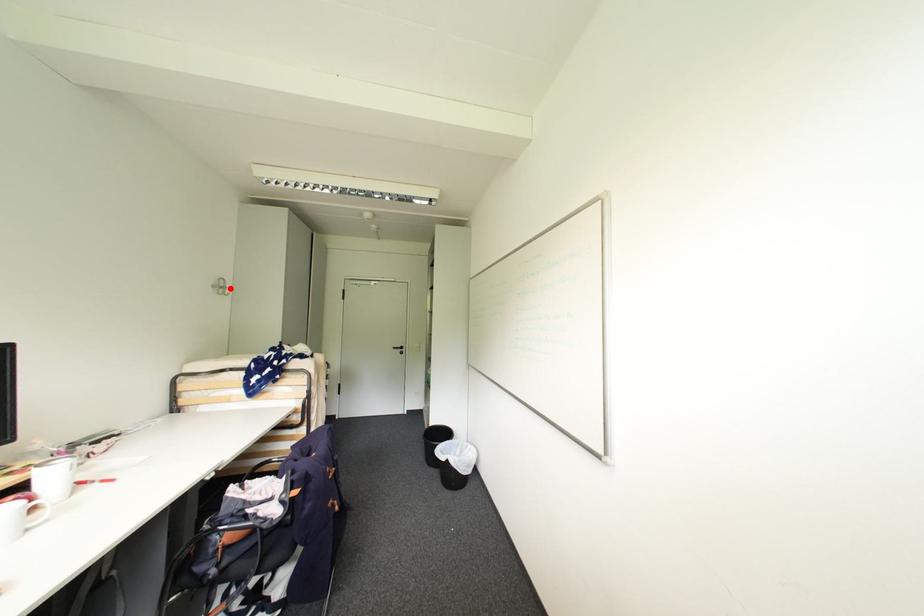
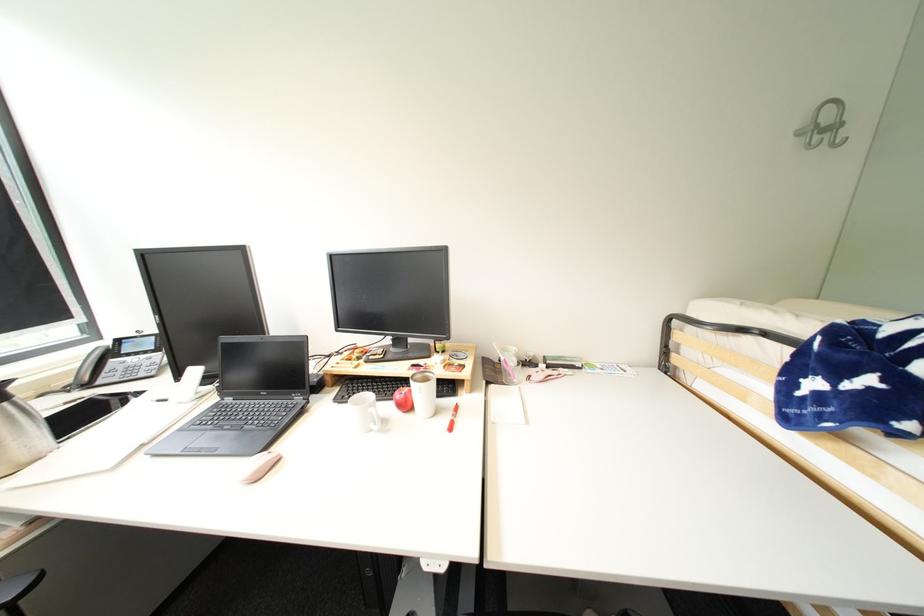
Locate, in the second image, the point that corresponds to the highlighted location in the first image.

(841, 128)